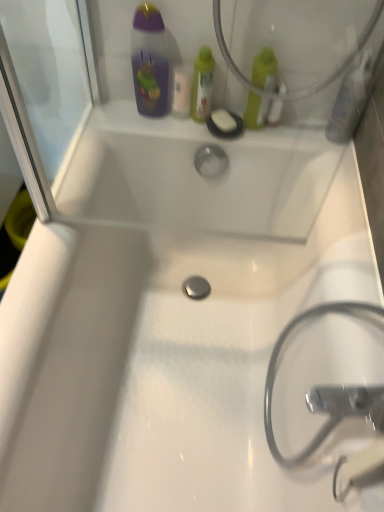
Where is `free space between green matte bottle at upper right, arranged as the 3th mouthwash when viewed from the right, and translucent plastic mouthwash at upper right, arranged as the first mouthwash when viewed from the right`? free space between green matte bottle at upper right, arranged as the 3th mouthwash when viewed from the right, and translucent plastic mouthwash at upper right, arranged as the first mouthwash when viewed from the right is located at coordinates (301, 128).